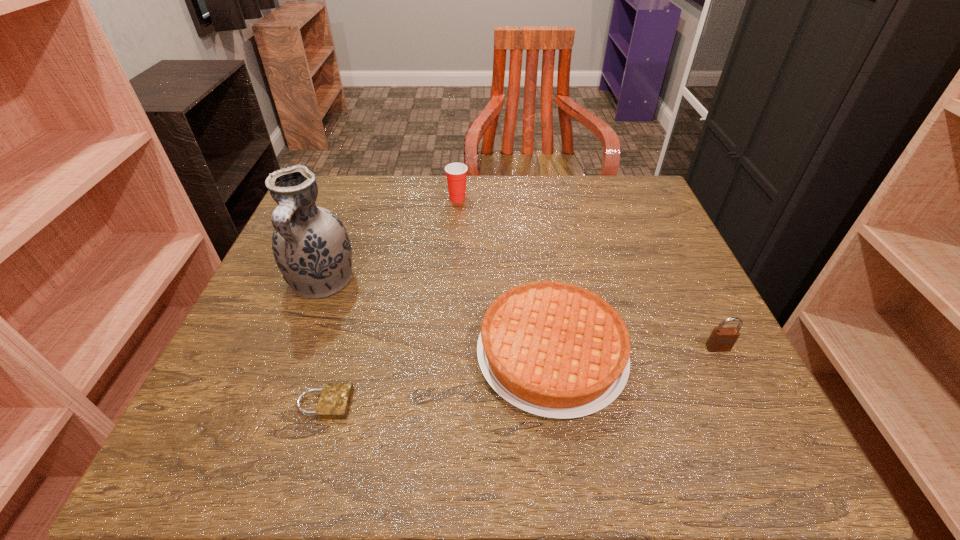
Where is `object that is at the near left corner`? The width and height of the screenshot is (960, 540). object that is at the near left corner is located at coordinates (334, 401).

In the image, there is a desktop. Identify the location of vacant space at the far edge. The height and width of the screenshot is (540, 960). (551, 204).

In the image, there is a desktop. Where is `vacant space at the near edge`? The width and height of the screenshot is (960, 540). vacant space at the near edge is located at coordinates (637, 445).

Locate an element on the screen. This screenshot has height=540, width=960. free space at the left edge is located at coordinates (307, 338).

Locate an element on the screen. The image size is (960, 540). vacant space at the right edge of the desktop is located at coordinates (657, 285).

Where is `vacant space at the far left corner`? This screenshot has width=960, height=540. vacant space at the far left corner is located at coordinates (348, 217).

Where is `vacant space at the near left corner`? Image resolution: width=960 pixels, height=540 pixels. vacant space at the near left corner is located at coordinates (x=221, y=462).

Locate an element on the screen. The height and width of the screenshot is (540, 960). blank space at the far right corner of the desktop is located at coordinates (601, 194).

The width and height of the screenshot is (960, 540). Find the location of `vacant region at the near right corner of the desktop`. vacant region at the near right corner of the desktop is located at coordinates (710, 445).

The height and width of the screenshot is (540, 960). In order to click on free space between the left padlock and the farthest object in this screenshot , I will do `click(391, 301)`.